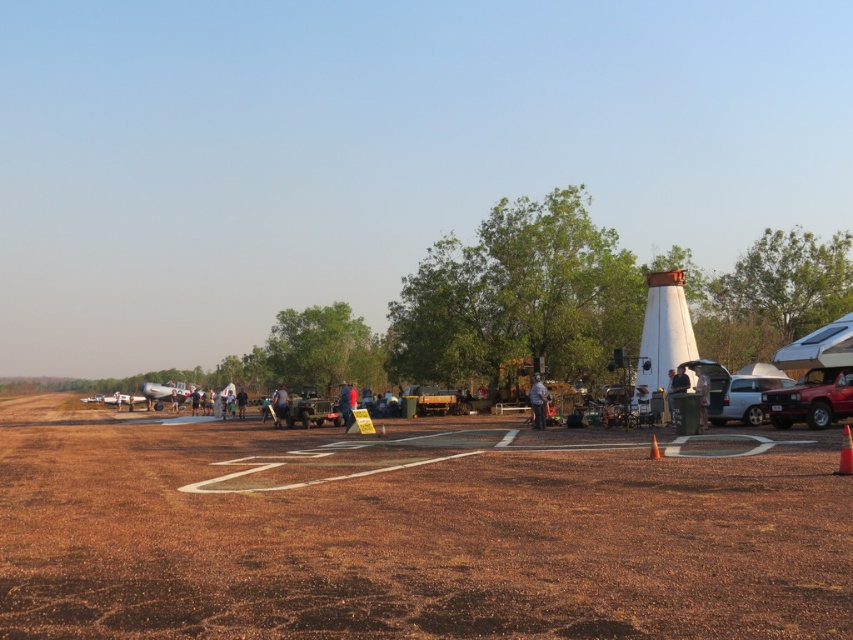
Question: Does brown dirt field at lower center lie behind orange cone at center?

Choices:
 (A) no
 (B) yes

Answer: (A)

Question: Is brown dirt field at lower center closer to the viewer compared to matte black jacket at center?

Choices:
 (A) yes
 (B) no

Answer: (A)

Question: Among these points, which one is nearest to the camera?

Choices:
 (A) tap(344, 394)
 (B) tap(651, 451)
 (C) tap(544, 426)
 (D) tap(177, 385)

Answer: (B)

Question: Which object is closer to the camera taking this photo?

Choices:
 (A) light brown leather jacket at center
 (B) shiny red car at right

Answer: (B)

Question: Can you confirm if metallic silver airplane at left is positioned to the left of light brown leather jacket at center?

Choices:
 (A) yes
 (B) no

Answer: (A)

Question: Among these objects, which one is nearest to the camera?

Choices:
 (A) orange matte traffic cone at center
 (B) matte black jacket at center
 (C) brown dirt field at lower center
 (D) blue denim shirt at center

Answer: (C)